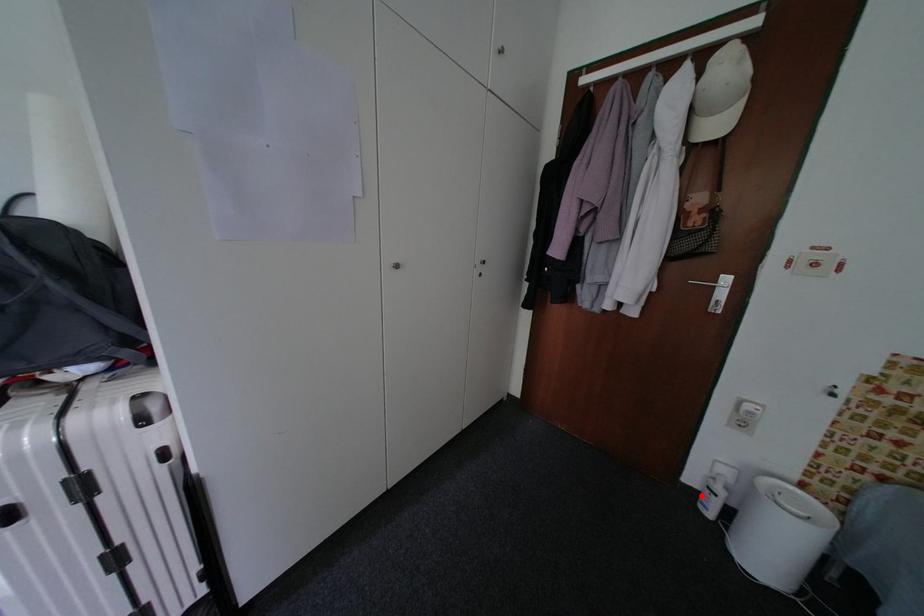
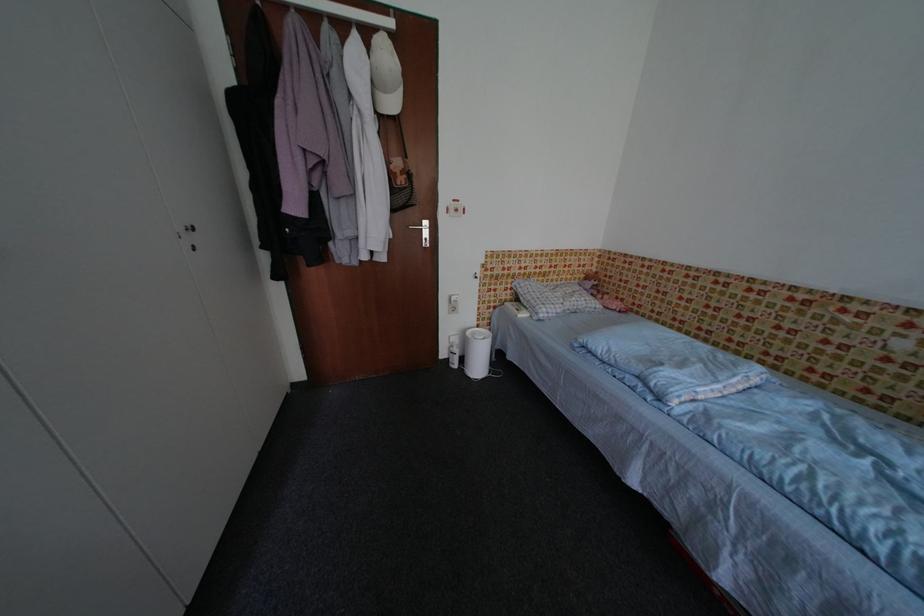
The point at the highlighted location is marked in the first image. Where is the corresponding point in the second image?

(455, 363)